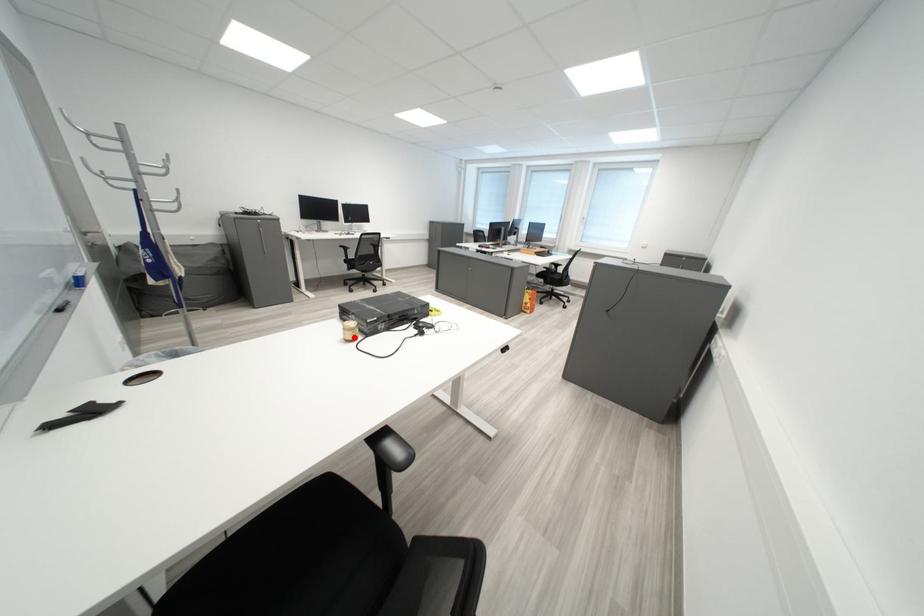
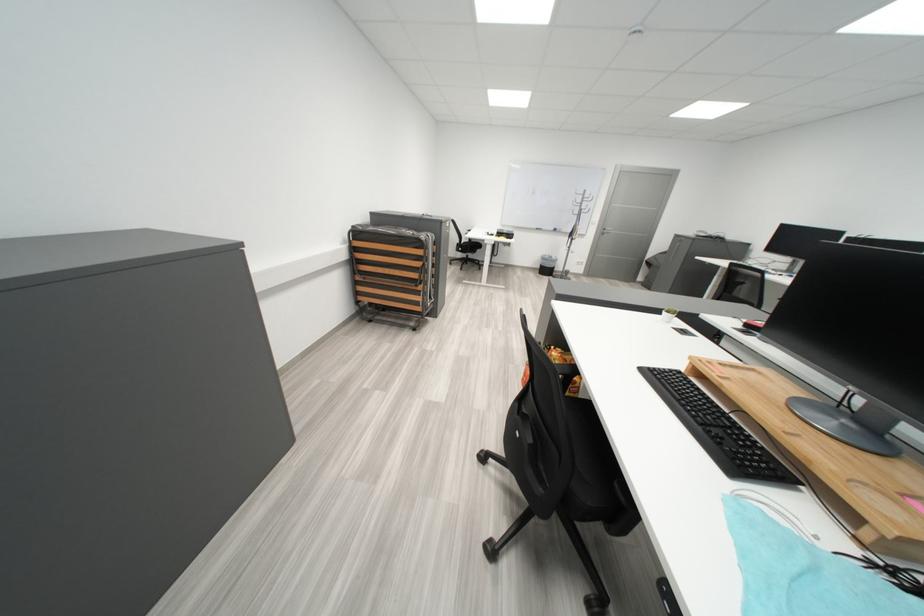
Question: I am providing you with two images of the same scene from different viewpoints. A red point is marked on the first image. At the location where the point appears in image 1, is it still visible in image 2?

Choices:
 (A) Yes
 (B) No

Answer: (B)